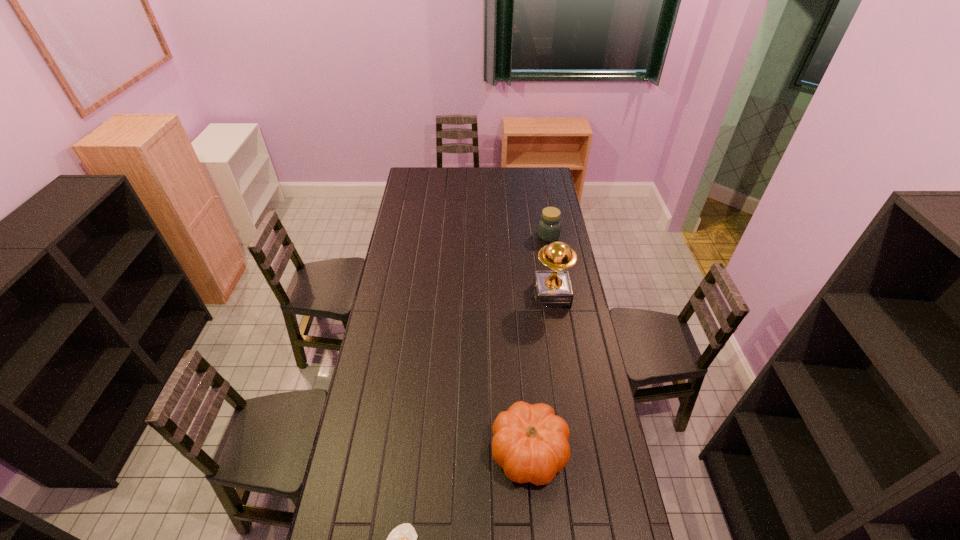
At what (x,y) coordinates should I click in order to perform the action: click on the tallest object. Please return your answer as a coordinate pair (x, y). Looking at the image, I should click on (552, 289).

This screenshot has width=960, height=540. I want to click on the second farthest object, so (552, 289).

This screenshot has height=540, width=960. In order to click on the second nearest object in this screenshot , I will do `click(530, 442)`.

Locate an element on the screen. The image size is (960, 540). the second tallest object is located at coordinates (530, 442).

Locate an element on the screen. Image resolution: width=960 pixels, height=540 pixels. the second shortest object is located at coordinates (549, 226).

What are the coordinates of `the farthest object` in the screenshot? It's located at [549, 226].

Find the location of a particular element. free spot located 0.090m on the front-facing side of the tallest object is located at coordinates (515, 295).

At what (x,y) coordinates should I click in order to perform the action: click on vacant region located 0.070m on the front-facing side of the tallest object. Please return your answer as a coordinate pair (x, y). Looking at the image, I should click on coord(518,295).

The height and width of the screenshot is (540, 960). I want to click on vacant space situated 0.350m on the front-facing side of the tallest object, so pyautogui.click(x=459, y=295).

This screenshot has height=540, width=960. I want to click on free space located 0.120m on the back of the pumpkin, so click(524, 388).